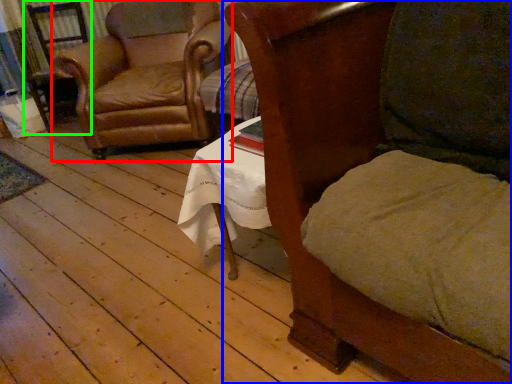
Question: Estimate the real-world distances between objects in this image. Which object is closer to chair (highlighted by a red box), chair (highlighted by a blue box) or armchair (highlighted by a green box)?

Choices:
 (A) chair
 (B) armchair

Answer: (B)